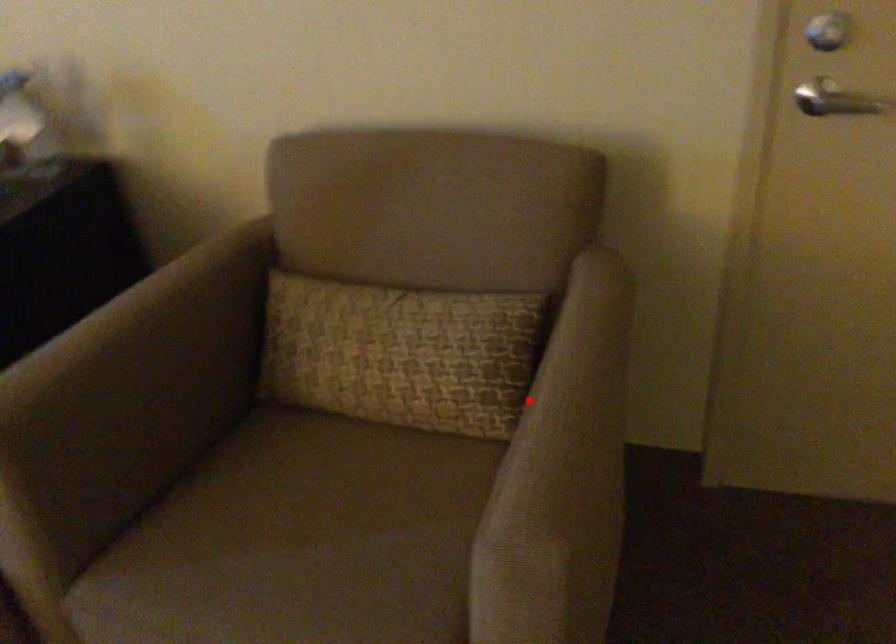
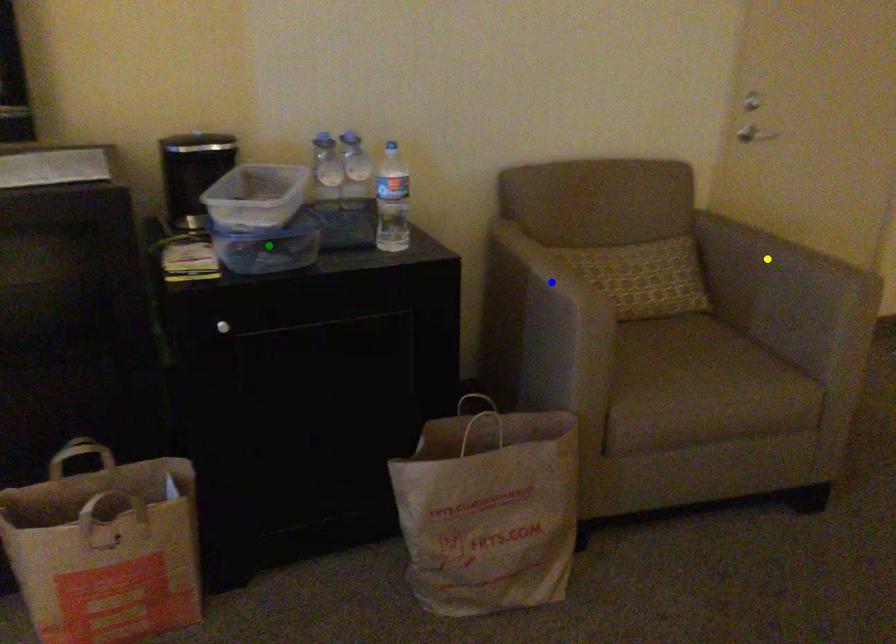
Question: I am providing you with two images of the same scene from different viewpoints. A red point is marked on the first image. You are given multiple points on the second image. Which spot in image 2 lines up with the point in image 1?

Choices:
 (A) green point
 (B) blue point
 (C) yellow point

Answer: (C)